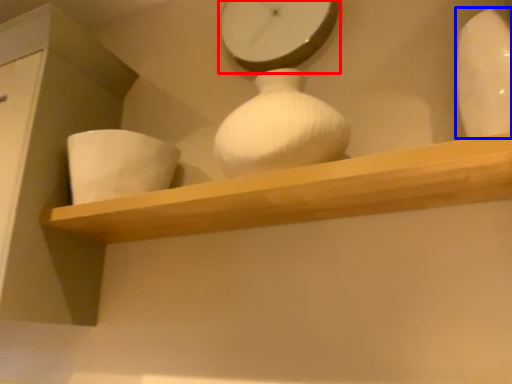
Question: Which point is further to the camera, clock (highlighted by a red box) or vase (highlighted by a blue box)?

Choices:
 (A) clock
 (B) vase

Answer: (A)